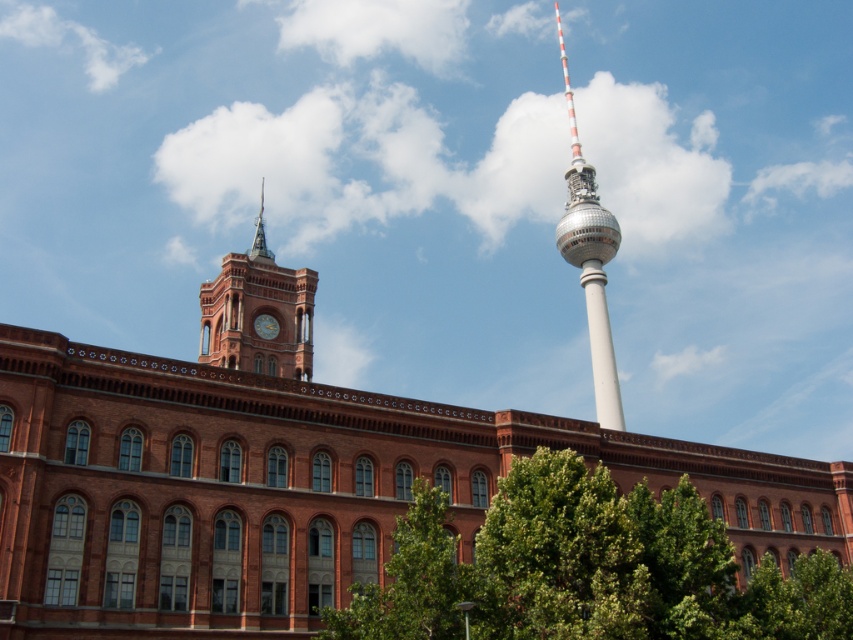
Question: Which point is farther to the camera?

Choices:
 (A) matte brick clock tower at upper left
 (B) white glossy tower at center
 (C) green leafy tree at center
 (D) golden metallic clock at upper left

Answer: (B)

Question: Is matte brick clock tower at upper left smaller than shiny silver spire at upper left?

Choices:
 (A) no
 (B) yes

Answer: (A)

Question: Does white glossy tower at center have a smaller size compared to shiny silver spire at upper left?

Choices:
 (A) no
 (B) yes

Answer: (A)

Question: Which of the following is the farthest from the observer?

Choices:
 (A) (592, 256)
 (B) (260, 230)
 (C) (648, 618)
 (D) (258, 330)

Answer: (A)

Question: Among these objects, which one is farthest from the camera?

Choices:
 (A) golden metallic clock at upper left
 (B) matte brick clock tower at upper left
 (C) green leafy tree at center
 (D) white glossy tower at center

Answer: (D)

Question: Where is matte brick clock tower at upper left located in relation to white glossy tower at center in the image?

Choices:
 (A) above
 (B) below

Answer: (A)